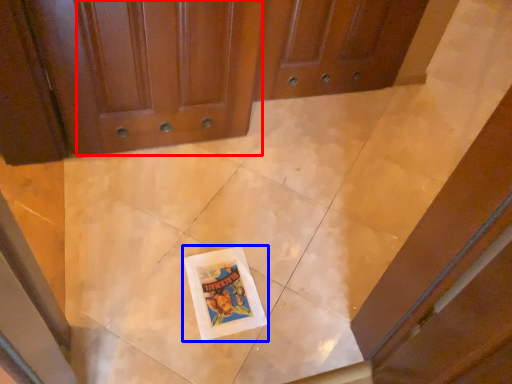
Question: Which of the following is the farthest to the observer, door (highlighted by a red box) or comic book (highlighted by a blue box)?

Choices:
 (A) door
 (B) comic book

Answer: (B)